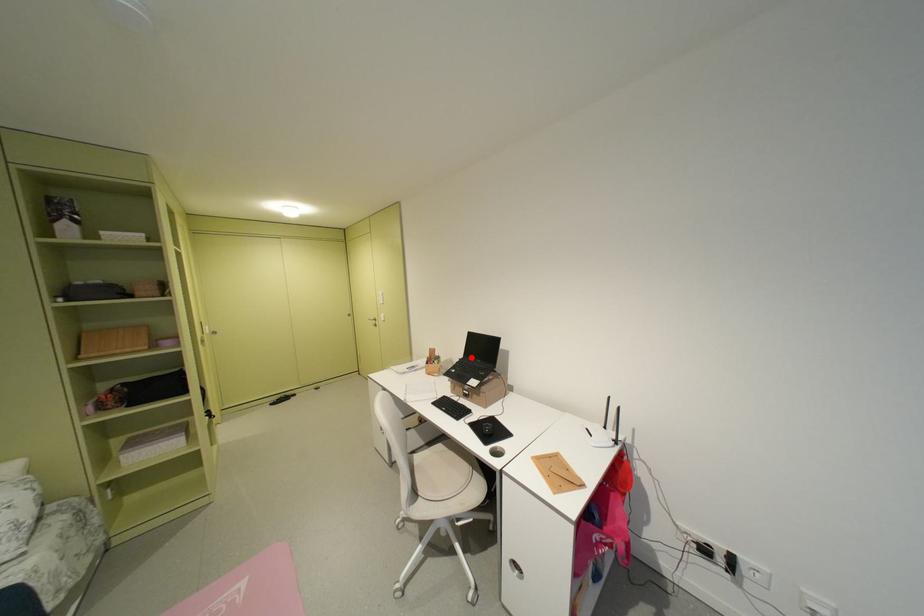
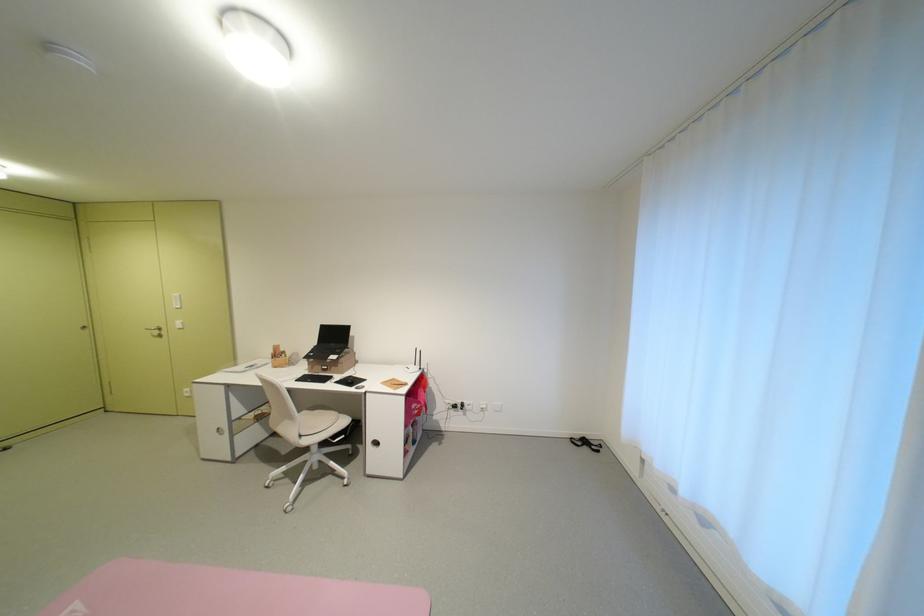
Find the pixel in the second image that matches the highlighted location in the first image.

(324, 345)